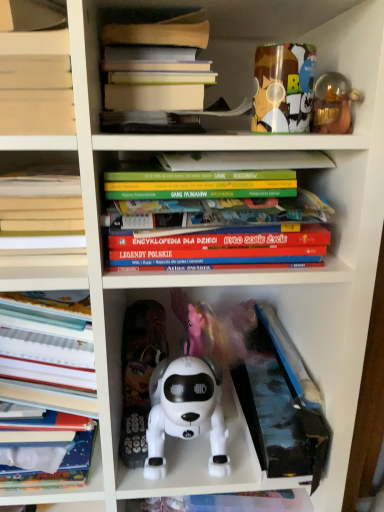
Question: Is hardcover books at center, positioned as the third book in bottom-to-top order, closer to the viewer compared to white plastic toy dog at center, placed as the 4th toy when sorted from right to left?

Choices:
 (A) no
 (B) yes

Answer: (B)

Question: Could you tell me if hardcover books at center, the second book viewed from the top, is turned towards white plastic toy dog at center, acting as the second toy starting from the bottom?

Choices:
 (A) no
 (B) yes

Answer: (A)

Question: Is hardcover books at center, positioned as the third book in bottom-to-top order, not inside white plastic toy dog at center, placed as the 4th toy when sorted from right to left?

Choices:
 (A) yes
 (B) no

Answer: (A)

Question: Would you say hardcover books at center, positioned as the third book in bottom-to-top order, contains white plastic toy dog at center, placed as the 4th toy when sorted from right to left?

Choices:
 (A) yes
 (B) no

Answer: (B)

Question: Considering the relative positions of hardcover books at center, positioned as the third book in bottom-to-top order, and white plastic toy dog at center, which is the 3th toy in top-to-bottom order, in the image provided, is hardcover books at center, positioned as the third book in bottom-to-top order, to the right of white plastic toy dog at center, which is the 3th toy in top-to-bottom order, from the viewer's perspective?

Choices:
 (A) no
 (B) yes

Answer: (B)

Question: Is white plastic robot dog at center, placed as the 3th toy when sorted from right to left, bigger or smaller than hardcover book at left, which is the second book in bottom-to-top order?

Choices:
 (A) big
 (B) small

Answer: (A)

Question: Is point (175, 396) positioned closer to the camera than point (81, 274)?

Choices:
 (A) closer
 (B) farther

Answer: (B)

Question: In the image, is white plastic robot dog at center, which ranks as the second toy in left-to-right order, positioned in front of or behind hardcover book at left, acting as the third book starting from the top?

Choices:
 (A) behind
 (B) front

Answer: (A)

Question: Is white plastic robot dog at center, which ranks as the second toy in left-to-right order, inside the boundaries of hardcover book at left, acting as the third book starting from the top, or outside?

Choices:
 (A) outside
 (B) inside

Answer: (A)

Question: Considering the relative positions of hardcover books at upper center, which is the 1th book from top to bottom, and translucent glass figurine at upper right, placed as the 1th toy when sorted from right to left, in the image provided, is hardcover books at upper center, which is the 1th book from top to bottom, to the left or to the right of translucent glass figurine at upper right, placed as the 1th toy when sorted from right to left,?

Choices:
 (A) left
 (B) right

Answer: (A)

Question: In terms of height, does hardcover books at upper center, which is the 1th book from top to bottom, look taller or shorter compared to translucent glass figurine at upper right, which is counted as the third toy, starting from the bottom?

Choices:
 (A) short
 (B) tall

Answer: (B)

Question: Is hardcover books at upper center, which is the 1th book from top to bottom, wider or thinner than translucent glass figurine at upper right, which is the fourth toy from left to right?

Choices:
 (A) wide
 (B) thin

Answer: (A)

Question: From the image's perspective, is hardcover books at upper center, which is the 1th book from top to bottom, located above or below translucent glass figurine at upper right, placed as the 1th toy when sorted from right to left?

Choices:
 (A) below
 (B) above

Answer: (B)

Question: From the image's perspective, is hardcover book at left, acting as the third book starting from the top, positioned above or below white plastic toy dog at center, which ranks as the first toy in left-to-right order?

Choices:
 (A) above
 (B) below

Answer: (A)

Question: From a real-world perspective, is hardcover book at left, which is the second book in bottom-to-top order, above or below white plastic toy dog at center, acting as the second toy starting from the bottom?

Choices:
 (A) below
 (B) above

Answer: (B)